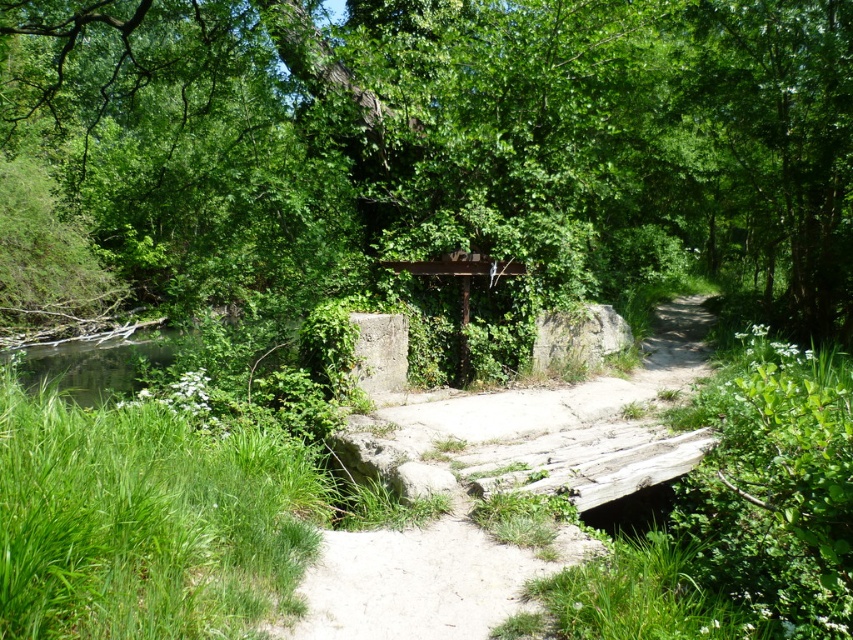
Who is shorter, green leafy tree at center or concrete bridge at center?

Standing shorter between the two is concrete bridge at center.

Can you confirm if green leafy tree at center is taller than concrete bridge at center?

Yes.

Describe the element at coordinates (448, 141) in the screenshot. I see `green leafy tree at center` at that location.

Locate an element on the screen. The width and height of the screenshot is (853, 640). green leafy tree at center is located at coordinates (448, 141).